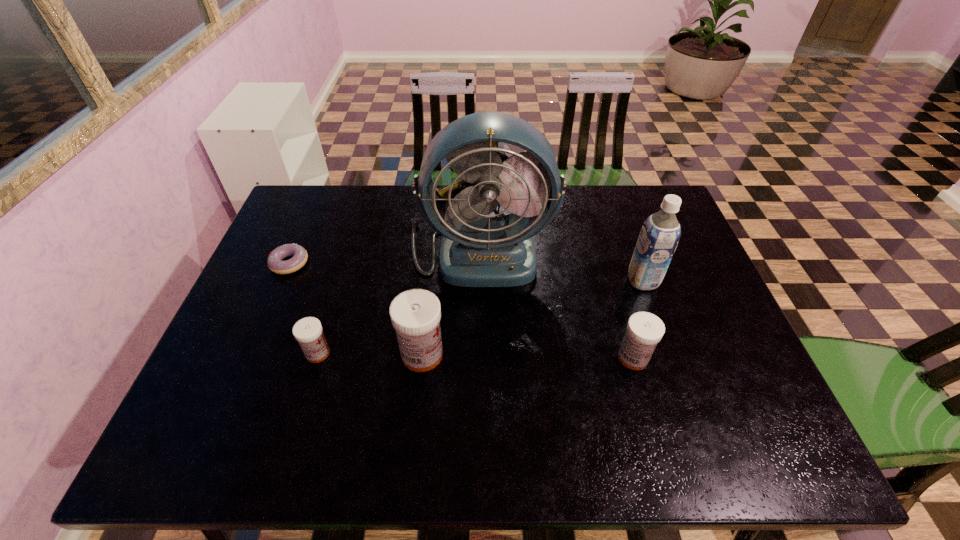
Where is `the leftmost medicine`? This screenshot has height=540, width=960. the leftmost medicine is located at coordinates (308, 331).

Where is `the fifth tallest object`? the fifth tallest object is located at coordinates (308, 331).

Identify the location of the second medicine from right to left. This screenshot has width=960, height=540. (415, 314).

Locate an element on the screen. Image resolution: width=960 pixels, height=540 pixels. the fourth shortest object is located at coordinates (415, 314).

What are the coordinates of `the second object from right to left` in the screenshot? It's located at (644, 331).

Locate an element on the screen. the third shortest object is located at coordinates (644, 331).

Locate an element on the screen. This screenshot has width=960, height=540. the tallest object is located at coordinates (476, 251).

Where is `the rightmost object`? The image size is (960, 540). the rightmost object is located at coordinates (659, 236).

Locate an element on the screen. The image size is (960, 540). the second tallest object is located at coordinates coord(659,236).

Locate an element on the screen. This screenshot has width=960, height=540. the leftmost object is located at coordinates (274, 261).